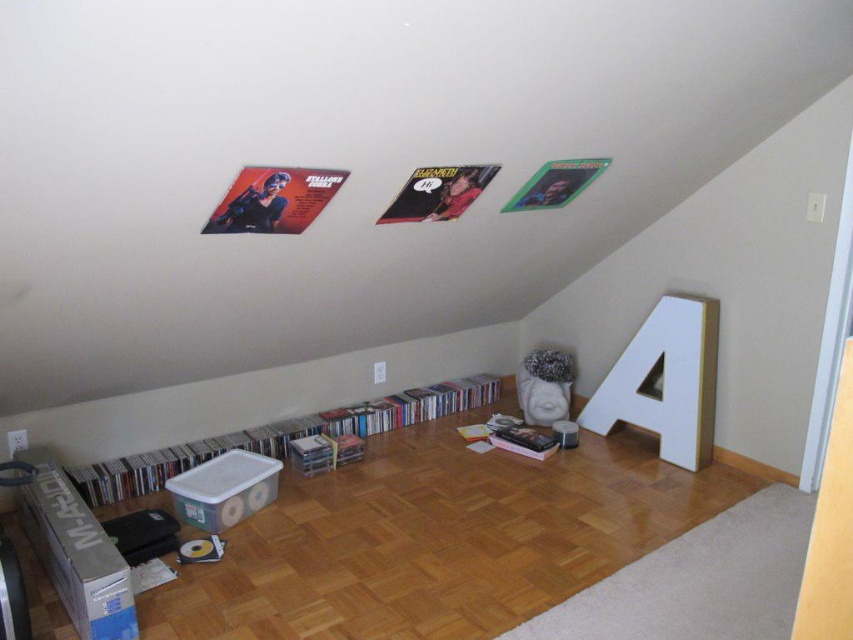
Is point (648, 346) farther from viewer compared to point (358, 424)?

No, (648, 346) is closer to viewer.

Who is positioned more to the left, white matte letter a at right or clear plastic storage at lower center?

clear plastic storage at lower center is more to the left.

Identify the location of white matte letter a at right. This screenshot has width=853, height=640. (665, 381).

This screenshot has width=853, height=640. In order to click on white matte letter a at right in this screenshot , I will do `click(665, 381)`.